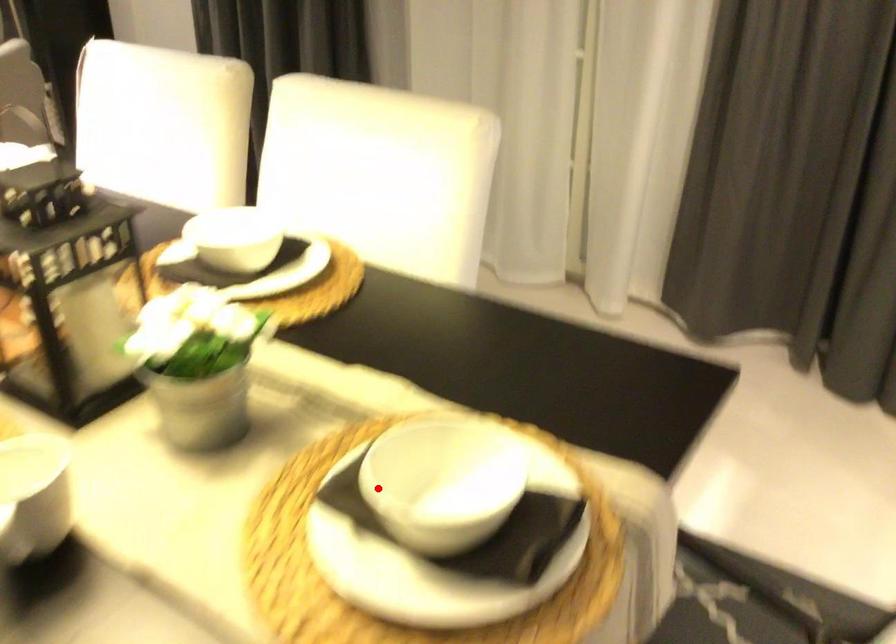
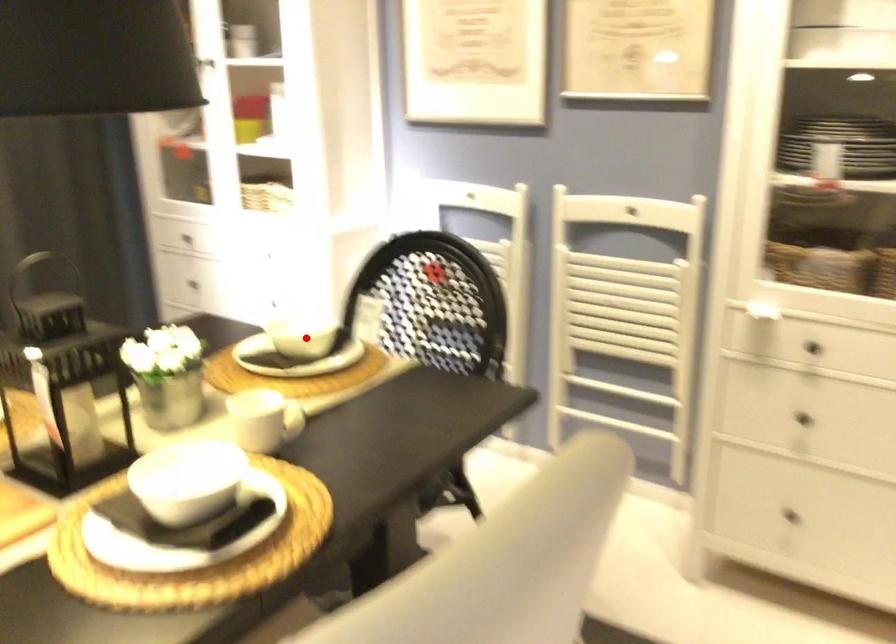
I am providing you with two images of the same scene from different viewpoints. A red point is marked on the first image and another point is marked on the second image. Is the marked point in image1 the same physical position as the marked point in image2?

Yes